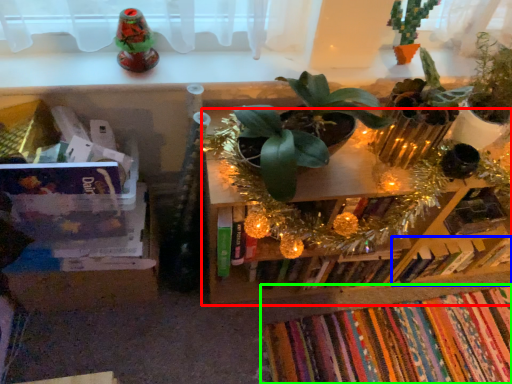
Question: Estimate the real-world distances between objects in this image. Which object is closer to shelf (highlighted by a red box), book (highlighted by a blue box) or book (highlighted by a green box)?

Choices:
 (A) book
 (B) book

Answer: (A)